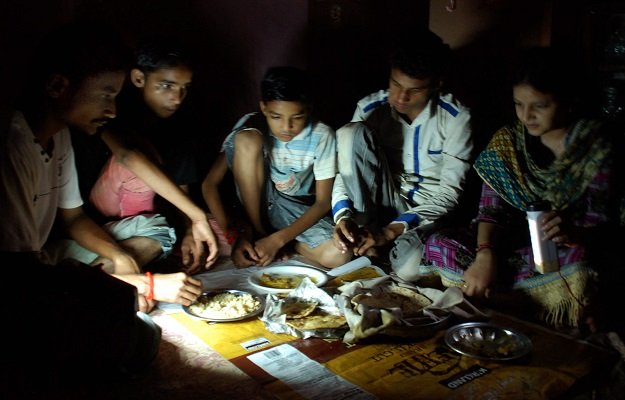
The height and width of the screenshot is (400, 625). In order to click on light source in this screenshot , I will do `click(111, 295)`.